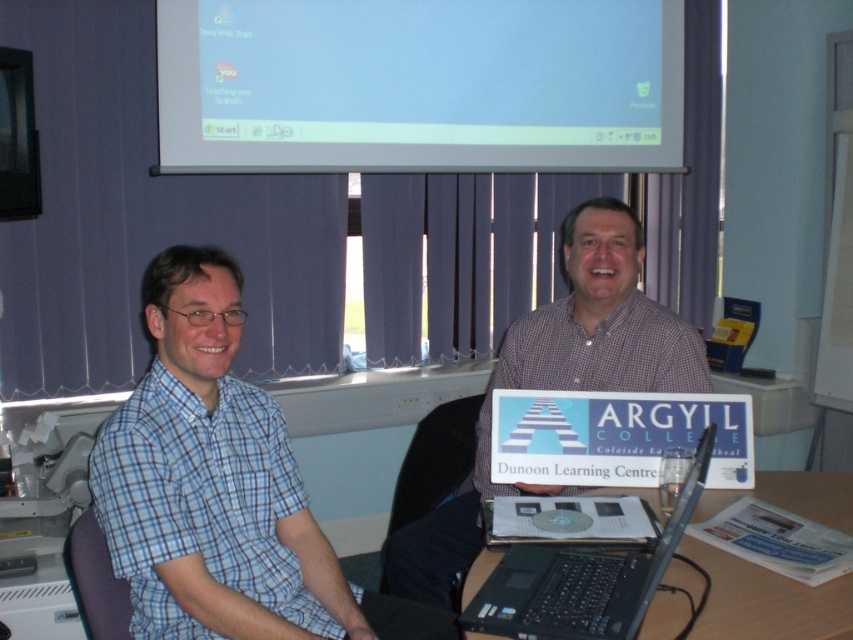
Looking at this image, you are a photographer taking a picture of the scene. You want to ensure the checkered shirt at center and the black plastic laptop at center are both clearly visible. Which object should you focus on first to make sure both are in focus?

The checkered shirt at center is in front of the black plastic laptop at center, so focusing on the checkered shirt at center first will ensure both are in focus since it is closer to the camera.

You are a photographer trying to capture a clear shot of the white glossy screen at upper center and the checkered shirt at center. Based on their positions, which object is located higher in the image?

The white glossy screen at upper center is positioned over the checkered shirt at center, so it is higher in the image.

You are trying to determine which object is bigger between the white glossy screen at upper center and the checkered shirt at center. Based on the scene, which one is larger?

The white glossy screen at upper center has a larger size compared to the checkered shirt at center, so the white glossy screen at upper center is bigger.